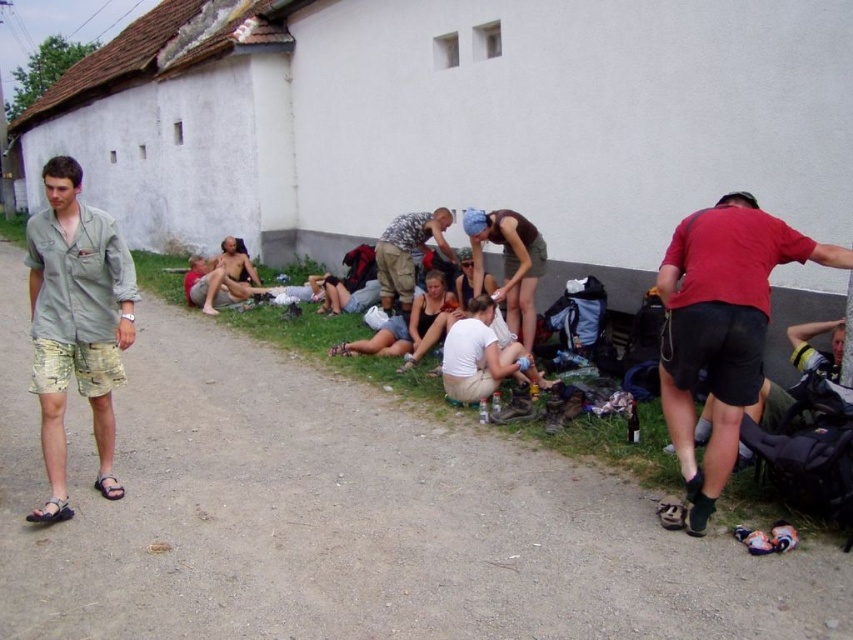
You are a photographer trying to capture a photo of the camouflage fabric shirt at center and the brown leather sandal at lower left. Which object should you focus on first if you want to ensure both are in the frame without moving your camera?

The camouflage fabric shirt at center should be focused on first because it has a greater height compared to the brown leather sandal at lower left, ensuring it stays within the frame while adjusting for the smaller object.

You are a photographer trying to capture the scene with a camera that has a 1.5 meter wide lens view. You want to include both the red matte shirt at lower right and the brown leather sandal at lower left in the frame. Given their sizes, will the total width of these two items fit within your camera lens view?

The red matte shirt at lower right is wider than the brown leather sandal at lower left. However, since the exact total width isn not specified, but the shirt is larger, it might exceed the 1.5 meter limit. Without precise measurements, it is uncertain if they will fit together within the 1.5 meter view.

Consider the image. You are standing at the center of the image and want to find the camouflage fabric shirt at center. In which direction should you look to locate it?

The camouflage fabric shirt at center is located at the center of the image, so you should look straight ahead to find it.